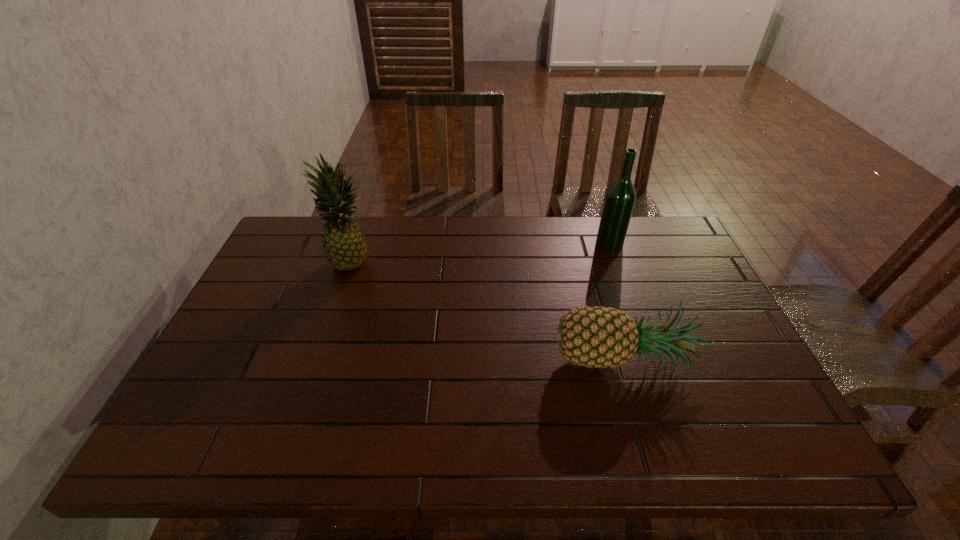
Where is `vacant space that satisfies the following two spatial constraints: 1. on the back side of the right pineapple; 2. on the left side of the alcohol`? Image resolution: width=960 pixels, height=540 pixels. vacant space that satisfies the following two spatial constraints: 1. on the back side of the right pineapple; 2. on the left side of the alcohol is located at coordinates (588, 243).

Where is `vacant space that satisfies the following two spatial constraints: 1. on the back side of the alcohol; 2. on the right side of the nearest object`? vacant space that satisfies the following two spatial constraints: 1. on the back side of the alcohol; 2. on the right side of the nearest object is located at coordinates (588, 243).

Where is `free spot that satisfies the following two spatial constraints: 1. on the back side of the alcohol; 2. on the right side of the leftmost object`? free spot that satisfies the following two spatial constraints: 1. on the back side of the alcohol; 2. on the right side of the leftmost object is located at coordinates (355, 243).